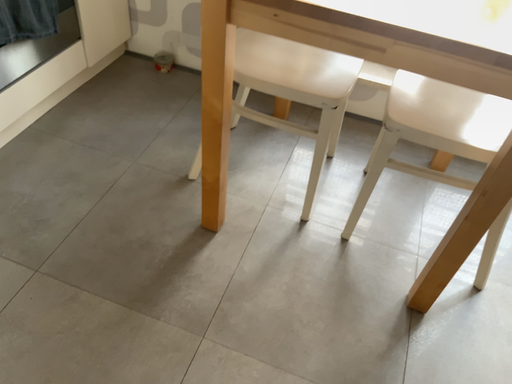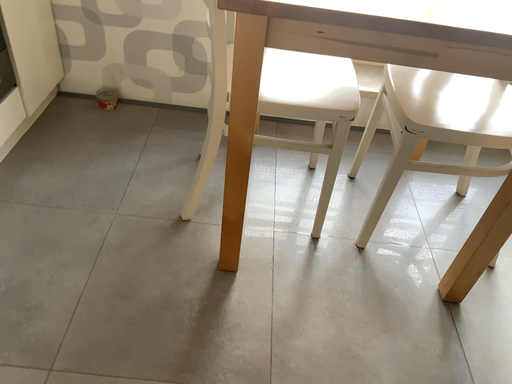
Question: How did the camera likely rotate when shooting the video?

Choices:
 (A) rotated right
 (B) rotated left

Answer: (A)